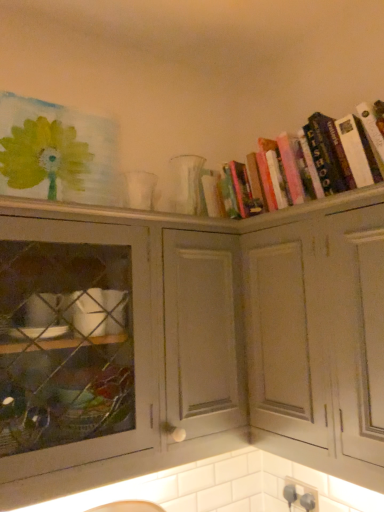
Question: Based on their sizes in the image, would you say white matte cabinet at upper right, which is counted as the 2th cabinetry, starting from the left, is bigger or smaller than hardcover books at upper right?

Choices:
 (A) small
 (B) big

Answer: (B)

Question: From a real-world perspective, is white matte cabinet at upper right, which is counted as the 2th cabinetry, starting from the left, above or below hardcover books at upper right?

Choices:
 (A) below
 (B) above

Answer: (A)

Question: Estimate the real-world distances between objects in this image. Which object is farther from the white matte cabinet at upper right, the first cabinetry from the right?

Choices:
 (A) matte gray cabinet at center, which ranks as the second cabinetry in right-to-left order
 (B) hardcover books at upper right

Answer: (B)

Question: Which is farther from the white matte cabinet at upper right, which is counted as the 2th cabinetry, starting from the left?

Choices:
 (A) matte gray cabinet at center, which ranks as the first cabinetry in left-to-right order
 (B) hardcover books at upper right

Answer: (B)